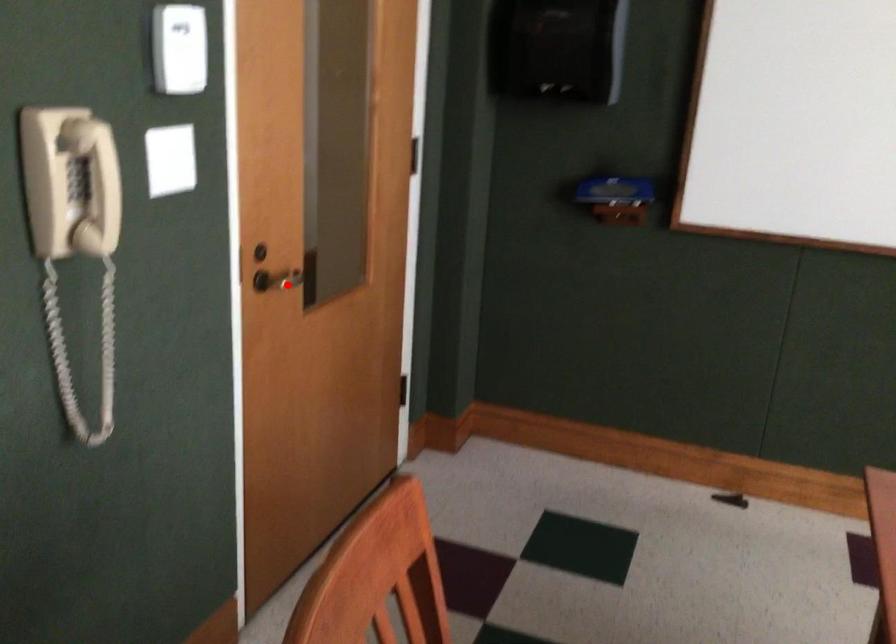
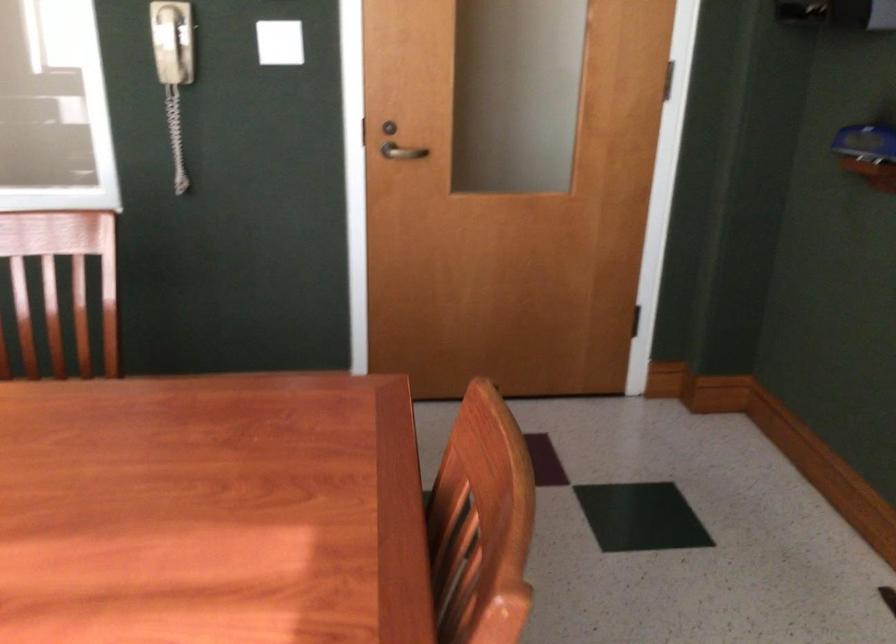
Question: A red point is marked in image1. In image2, is the corresponding 3D point closer to the camera or farther? Reply with the corresponding letter.

Choices:
 (A) The corresponding 3D point is closer.
 (B) The corresponding 3D point is farther.

Answer: (B)